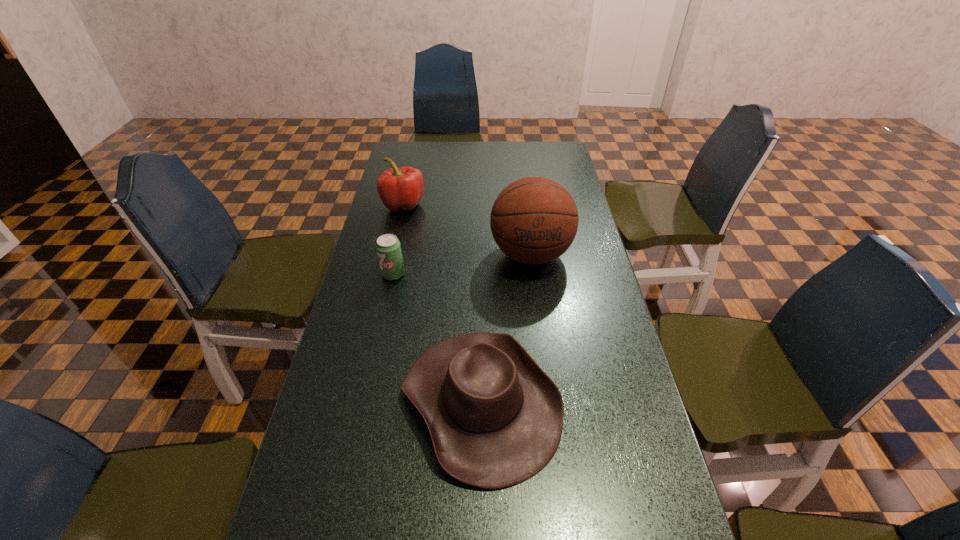
Point out which object is positioned as the second nearest to the basketball. Please provide its 2D coordinates. Your answer should be formatted as a tuple, i.e. [(x, y)], where the tuple contains the x and y coordinates of a point satisfying the conditions above.

[(402, 188)]